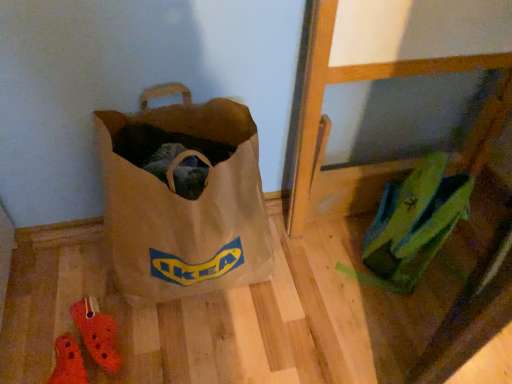
Where is `vacant area on the back side of rubber crocs at lower left, which is counted as the 1th footwear, starting from the bottom`? vacant area on the back side of rubber crocs at lower left, which is counted as the 1th footwear, starting from the bottom is located at coordinates (95, 306).